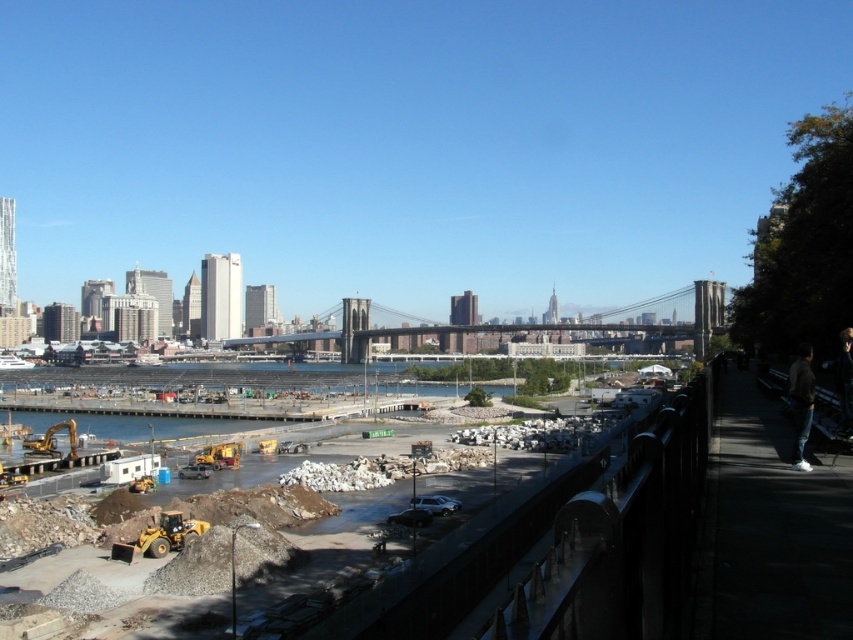
Does gravelly dirt at center come behind dark gray hoodie at right?

That is False.

Is point (569, 589) positioned behind point (811, 404)?

No, it is in front of (811, 404).

Locate an element on the screen. The width and height of the screenshot is (853, 640). gravelly dirt at center is located at coordinates (566, 540).

Which is above, metallic gray bridge at center or dark gray hoodie at right?

Positioned higher is metallic gray bridge at center.

Does point (698, 280) come in front of point (804, 436)?

No, (698, 280) is behind (804, 436).

Which is in front, point (451, 326) or point (801, 376)?

Point (801, 376) is in front.

Image resolution: width=853 pixels, height=640 pixels. Find the location of `metallic gray bridge at center`. metallic gray bridge at center is located at coordinates (323, 332).

Does gravelly dirt at center appear over metallic gray bridge at center?

No.

Is gravelly dirt at center smaller than metallic gray bridge at center?

Indeed, gravelly dirt at center has a smaller size compared to metallic gray bridge at center.

Does point (659, 483) come in front of point (699, 317)?

Yes, it is.

At what (x,y) coordinates should I click in order to perform the action: click on gravelly dirt at center. Please return your answer as a coordinate pair (x, y). This screenshot has width=853, height=640. Looking at the image, I should click on (566, 540).